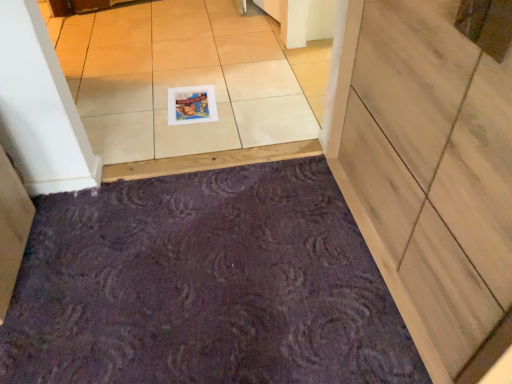
Question: Is purple textured bath mat at lower center located outside matte plastic postcard at center?

Choices:
 (A) no
 (B) yes

Answer: (B)

Question: Is purple textured bath mat at lower center thinner than matte plastic postcard at center?

Choices:
 (A) no
 (B) yes

Answer: (A)

Question: From a real-world perspective, is purple textured bath mat at lower center located beneath matte plastic postcard at center?

Choices:
 (A) yes
 (B) no

Answer: (A)

Question: Is purple textured bath mat at lower center wider than matte plastic postcard at center?

Choices:
 (A) yes
 (B) no

Answer: (A)

Question: Is purple textured bath mat at lower center positioned with its back to matte plastic postcard at center?

Choices:
 (A) yes
 (B) no

Answer: (B)

Question: From the image's perspective, is purple textured bath mat at lower center over matte plastic postcard at center?

Choices:
 (A) no
 (B) yes

Answer: (A)

Question: Does purple textured bath mat at lower center appear on the right side of white glossy tile at upper center?

Choices:
 (A) yes
 (B) no

Answer: (A)

Question: Does purple textured bath mat at lower center lie in front of white glossy tile at upper center?

Choices:
 (A) no
 (B) yes

Answer: (B)

Question: Is purple textured bath mat at lower center aimed at white glossy tile at upper center?

Choices:
 (A) no
 (B) yes

Answer: (B)

Question: Does purple textured bath mat at lower center contain white glossy tile at upper center?

Choices:
 (A) no
 (B) yes

Answer: (A)

Question: Does purple textured bath mat at lower center have a lesser height compared to white glossy tile at upper center?

Choices:
 (A) yes
 (B) no

Answer: (B)

Question: From the image's perspective, is purple textured bath mat at lower center on top of white glossy tile at upper center?

Choices:
 (A) yes
 (B) no

Answer: (B)

Question: Can you confirm if wooden door at lower right is positioned to the left of matte plastic postcard at center?

Choices:
 (A) no
 (B) yes

Answer: (A)